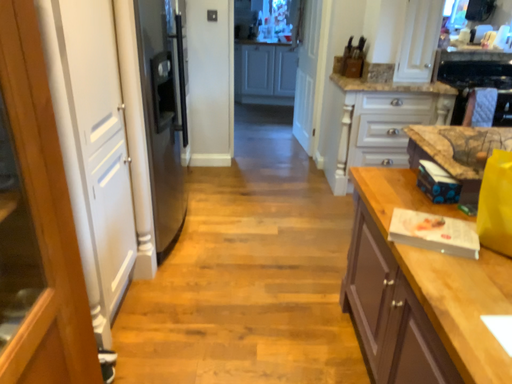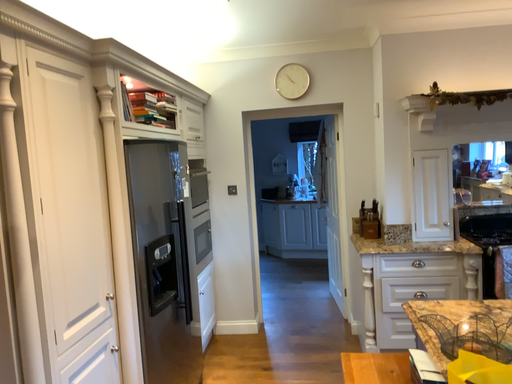
Question: Which way did the camera rotate in the video?

Choices:
 (A) rotated downward
 (B) rotated upward

Answer: (B)